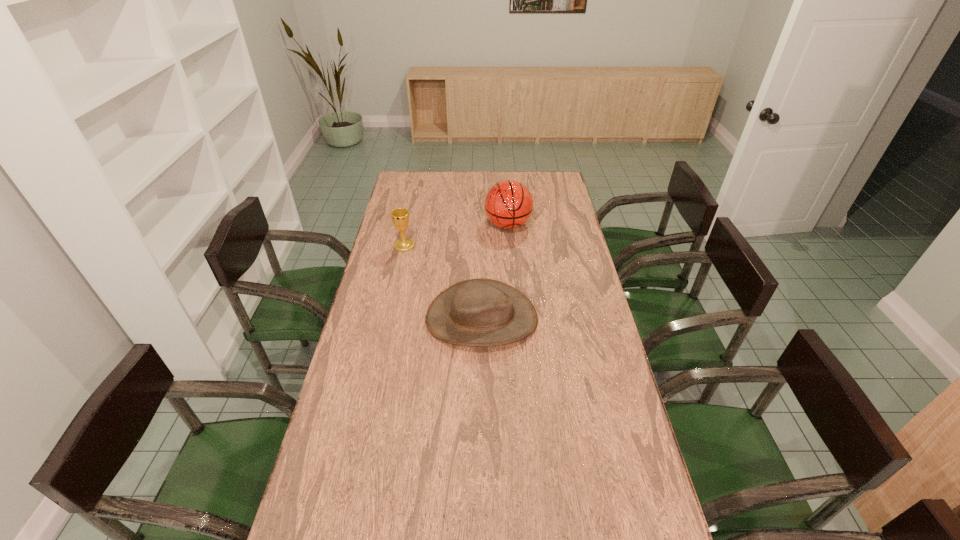
At what (x,y) coordinates should I click in order to perform the action: click on the tallest object. Please return your answer as a coordinate pair (x, y). Looking at the image, I should click on (508, 204).

At what (x,y) coordinates should I click in order to perform the action: click on the farthest object. Please return your answer as a coordinate pair (x, y). Looking at the image, I should click on (508, 204).

Identify the location of chalice. This screenshot has width=960, height=540. (400, 216).

Where is `the leftmost object`? This screenshot has width=960, height=540. the leftmost object is located at coordinates (400, 216).

You are a GUI agent. You are given a task and a screenshot of the screen. Output one action in this format:
    pyautogui.click(x=<x>, y=<y>)
    Task: Click on the nearest object
    
    Given the screenshot: What is the action you would take?
    pyautogui.click(x=481, y=312)

The image size is (960, 540). What are the coordinates of `cowboy hat` in the screenshot? It's located at (481, 312).

Where is `vacant region located 0.070m on the side with spill of the farthest object`? Image resolution: width=960 pixels, height=540 pixels. vacant region located 0.070m on the side with spill of the farthest object is located at coordinates (510, 249).

This screenshot has width=960, height=540. In order to click on vacant space located 0.210m on the right of the leftmost object in this screenshot , I will do `click(465, 246)`.

What are the coordinates of `free space located 0.370m on the front of the nearest object` in the screenshot? It's located at (482, 467).

Locate an element on the screen. The width and height of the screenshot is (960, 540). object at the left edge is located at coordinates (400, 216).